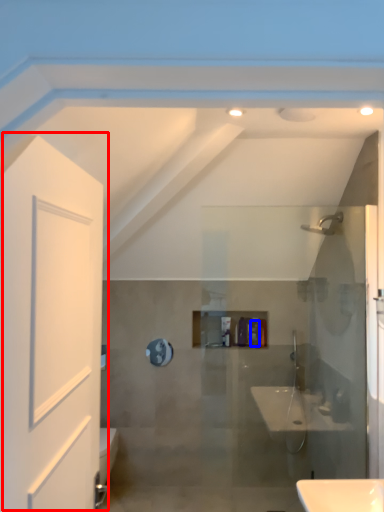
Question: Which point is further to the camera, door (highlighted by a red box) or toiletry (highlighted by a blue box)?

Choices:
 (A) door
 (B) toiletry

Answer: (B)